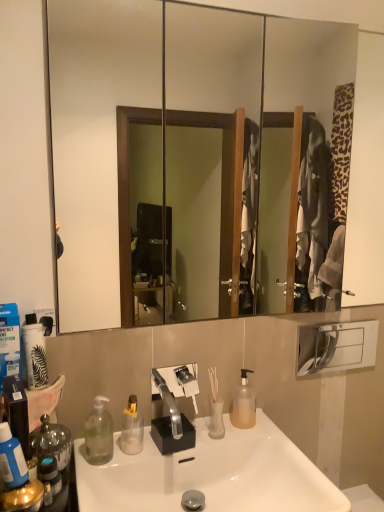
Question: Considering the relative sizes of translucent plastic pump bottle at center, the 4th bottle in the front-to-back sequence, and clear plastic bottle at lower left, which is counted as the third bottle, starting from the back, in the image provided, is translucent plastic pump bottle at center, the 4th bottle in the front-to-back sequence, thinner than clear plastic bottle at lower left, which is counted as the third bottle, starting from the back,?

Choices:
 (A) yes
 (B) no

Answer: (A)

Question: Considering the relative sizes of translucent plastic pump bottle at center, the 1th bottle from the back, and clear plastic bottle at lower left, the second bottle positioned from the front, in the image provided, is translucent plastic pump bottle at center, the 1th bottle from the back, smaller than clear plastic bottle at lower left, the second bottle positioned from the front,?

Choices:
 (A) yes
 (B) no

Answer: (A)

Question: Considering the relative positions of translucent plastic pump bottle at center, which is the 1th bottle from right to left, and clear plastic bottle at lower left, which is counted as the third bottle, starting from the back, in the image provided, is translucent plastic pump bottle at center, which is the 1th bottle from right to left, to the left of clear plastic bottle at lower left, which is counted as the third bottle, starting from the back, from the viewer's perspective?

Choices:
 (A) yes
 (B) no

Answer: (B)

Question: From a real-world perspective, is translucent plastic pump bottle at center, arranged as the fourth bottle when viewed from the left, positioned under clear plastic bottle at lower left, arranged as the 2th bottle when viewed from the left, based on gravity?

Choices:
 (A) yes
 (B) no

Answer: (B)

Question: Considering the relative sizes of translucent plastic pump bottle at center, the 1th bottle from the back, and clear plastic bottle at lower left, arranged as the 2th bottle when viewed from the left, in the image provided, is translucent plastic pump bottle at center, the 1th bottle from the back, wider than clear plastic bottle at lower left, arranged as the 2th bottle when viewed from the left,?

Choices:
 (A) no
 (B) yes

Answer: (A)

Question: Is clear plastic bottle at lower left, the second bottle positioned from the front, in front of or behind blue matte bottle at left, which is the 1th bottle from front to back, in the image?

Choices:
 (A) front
 (B) behind

Answer: (B)

Question: Looking at their shapes, would you say clear plastic bottle at lower left, which appears as the third bottle when viewed from the right, is wider or thinner than blue matte bottle at left, which is the 1th bottle from front to back?

Choices:
 (A) thin
 (B) wide

Answer: (B)

Question: Considering the positions of clear plastic bottle at lower left, arranged as the 2th bottle when viewed from the left, and blue matte bottle at left, arranged as the fourth bottle when viewed from the back, in the image, is clear plastic bottle at lower left, arranged as the 2th bottle when viewed from the left, taller or shorter than blue matte bottle at left, arranged as the fourth bottle when viewed from the back,?

Choices:
 (A) tall
 (B) short

Answer: (A)

Question: Is point (97, 401) positioned closer to the camera than point (18, 464)?

Choices:
 (A) farther
 (B) closer

Answer: (A)

Question: From the image's perspective, relative to white glossy sink at center, is clear glass vase at center above or below?

Choices:
 (A) below
 (B) above

Answer: (B)

Question: Is clear glass vase at center bigger or smaller than white glossy sink at center?

Choices:
 (A) small
 (B) big

Answer: (A)

Question: Considering their positions, is clear glass vase at center located in front of or behind white glossy sink at center?

Choices:
 (A) front
 (B) behind

Answer: (B)

Question: From a real-world perspective, is clear glass vase at center physically located above or below white glossy sink at center?

Choices:
 (A) above
 (B) below

Answer: (A)

Question: Is clear plastic bottle at lower left, the second bottle positioned from the front, situated inside translucent plastic pump bottle at center, arranged as the fourth bottle when viewed from the left, or outside?

Choices:
 (A) outside
 (B) inside

Answer: (A)

Question: Considering the relative positions of clear plastic bottle at lower left, arranged as the 2th bottle when viewed from the left, and translucent plastic pump bottle at center, which is the 1th bottle from right to left, in the image provided, is clear plastic bottle at lower left, arranged as the 2th bottle when viewed from the left, to the left or to the right of translucent plastic pump bottle at center, which is the 1th bottle from right to left,?

Choices:
 (A) right
 (B) left

Answer: (B)